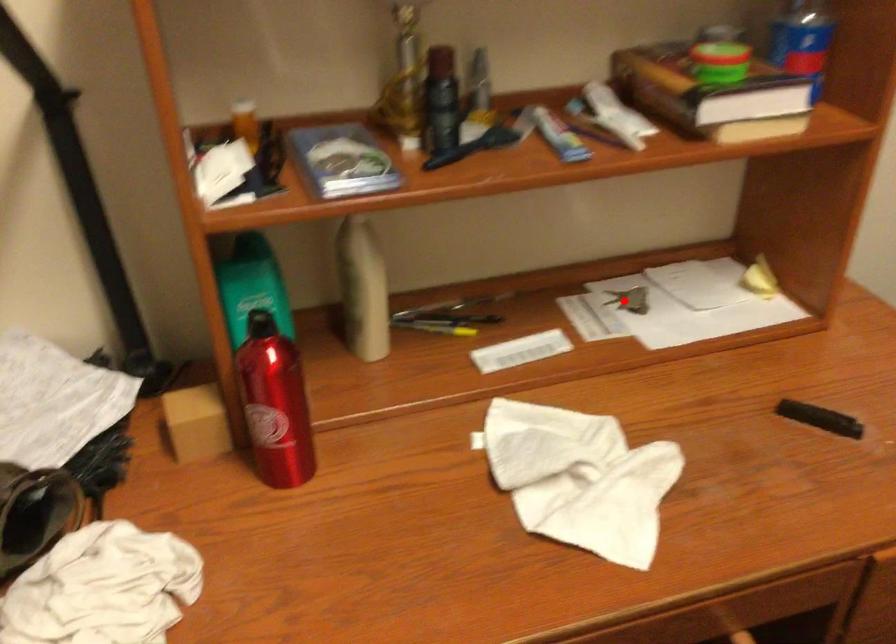
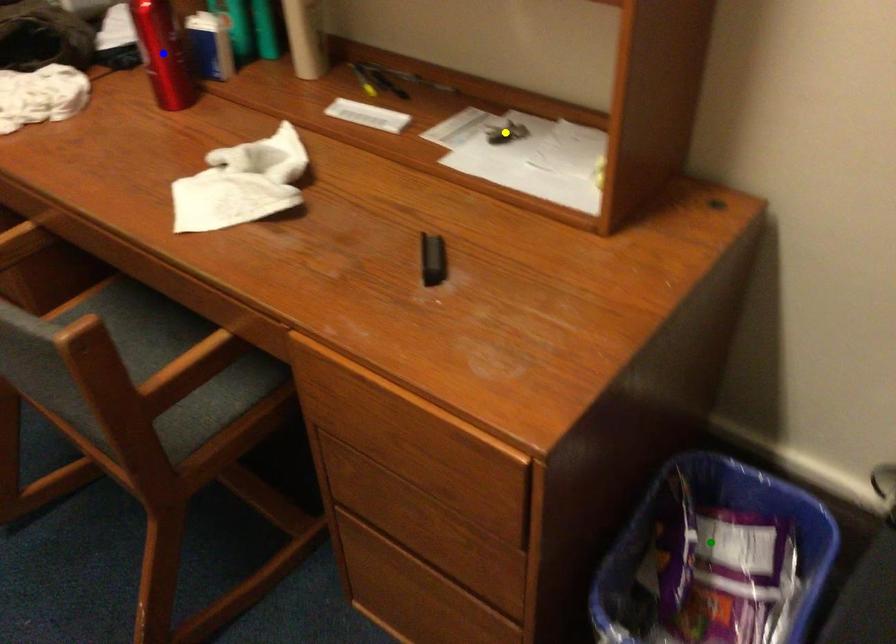
Question: I am providing you with two images of the same scene from different viewpoints. A red point is marked on the first image. You are given multiple points on the second image. In image 2, which mark is for the same physical point as the one in image 1?

Choices:
 (A) blue point
 (B) green point
 (C) yellow point

Answer: (C)